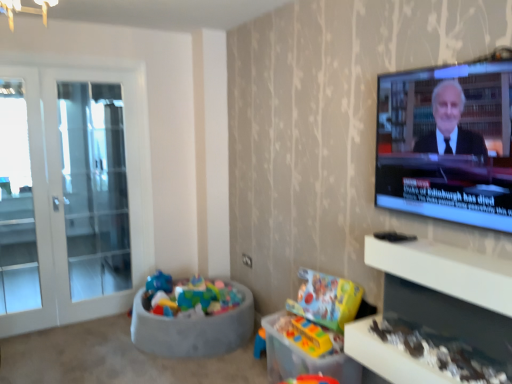
Question: Is white glass door at left outside of white glossy entertainment center at lower right?

Choices:
 (A) yes
 (B) no

Answer: (A)

Question: Is white glass door at left closer to camera compared to white glossy entertainment center at lower right?

Choices:
 (A) no
 (B) yes

Answer: (A)

Question: Does white glass door at left have a larger size compared to white glossy entertainment center at lower right?

Choices:
 (A) yes
 (B) no

Answer: (A)

Question: Does white glass door at left have a greater width compared to white glossy entertainment center at lower right?

Choices:
 (A) no
 (B) yes

Answer: (A)

Question: From the image's perspective, is white glass door at left on white glossy entertainment center at lower right?

Choices:
 (A) no
 (B) yes

Answer: (B)

Question: Is point (x=415, y=119) positioned closer to the camera than point (x=248, y=301)?

Choices:
 (A) closer
 (B) farther

Answer: (A)

Question: Is matte black tv at upper right taller or shorter than multicolored fabric bean bag at lower left?

Choices:
 (A) tall
 (B) short

Answer: (A)

Question: In the image, is matte black tv at upper right on the left side or the right side of multicolored fabric bean bag at lower left?

Choices:
 (A) right
 (B) left

Answer: (A)

Question: From the image's perspective, is matte black tv at upper right located above or below multicolored fabric bean bag at lower left?

Choices:
 (A) below
 (B) above

Answer: (B)

Question: From a real-world perspective, is matte black tv at upper right positioned above or below white glass door at left?

Choices:
 (A) below
 (B) above

Answer: (B)

Question: Is matte black tv at upper right in front of or behind white glass door at left in the image?

Choices:
 (A) front
 (B) behind

Answer: (A)

Question: Is matte black tv at upper right taller or shorter than white glass door at left?

Choices:
 (A) tall
 (B) short

Answer: (B)

Question: Is matte black tv at upper right wider or thinner than white glass door at left?

Choices:
 (A) thin
 (B) wide

Answer: (A)

Question: Considering the positions of matte black tv at upper right and white glossy entertainment center at lower right in the image, is matte black tv at upper right wider or thinner than white glossy entertainment center at lower right?

Choices:
 (A) thin
 (B) wide

Answer: (A)

Question: Is matte black tv at upper right taller or shorter than white glossy entertainment center at lower right?

Choices:
 (A) short
 (B) tall

Answer: (B)